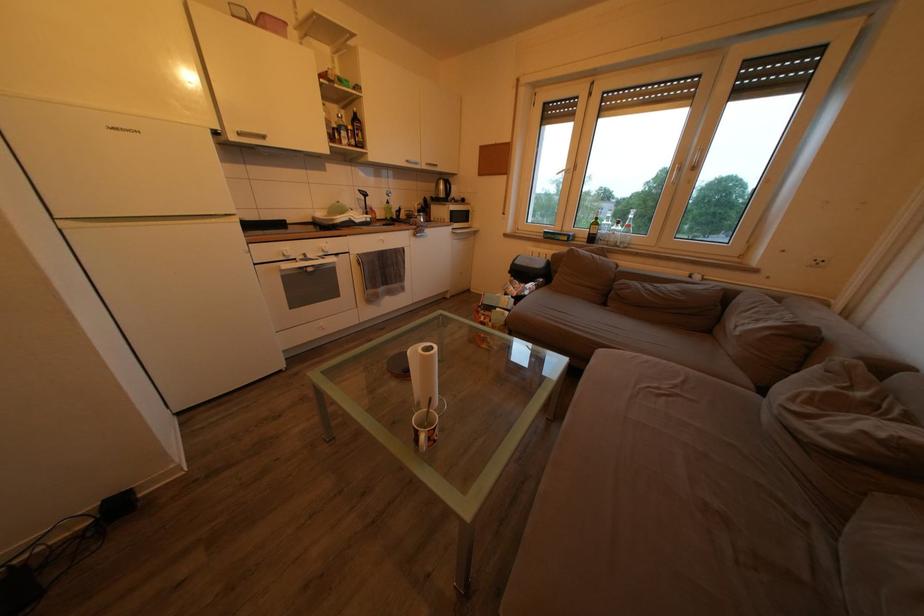
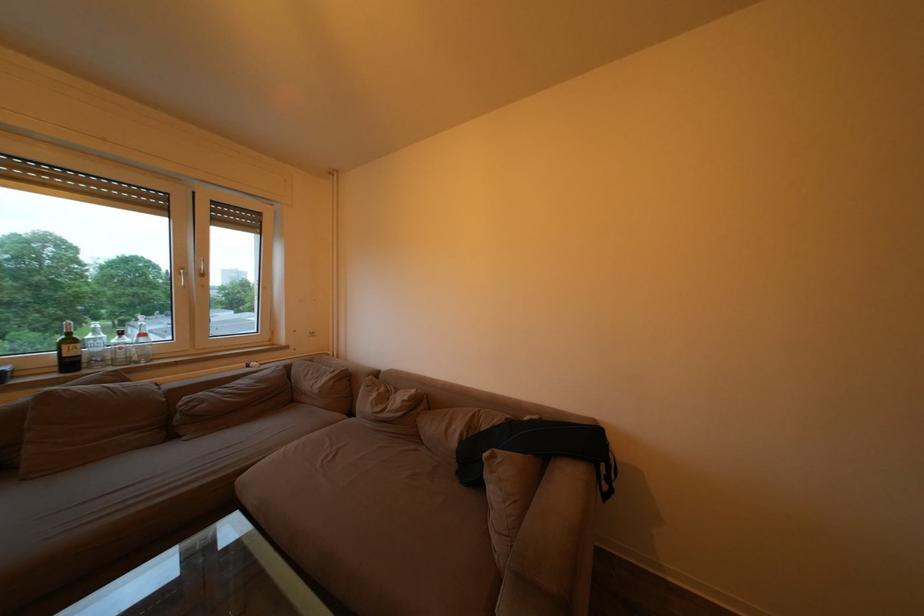
Locate, in the second image, the point that corresponds to (603,230) in the first image.

(79, 347)